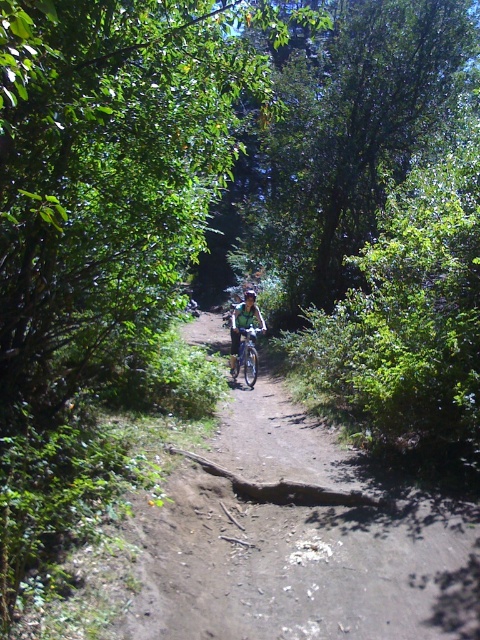
You are planning to take a photo of the dirt path at center and the shiny silver mountain bike at center from above. Considering their heights, which one will appear smaller in the photo?

The dirt path at center has a lesser height compared to the shiny silver mountain bike at center, so the dirt path at center will appear smaller in the photo.